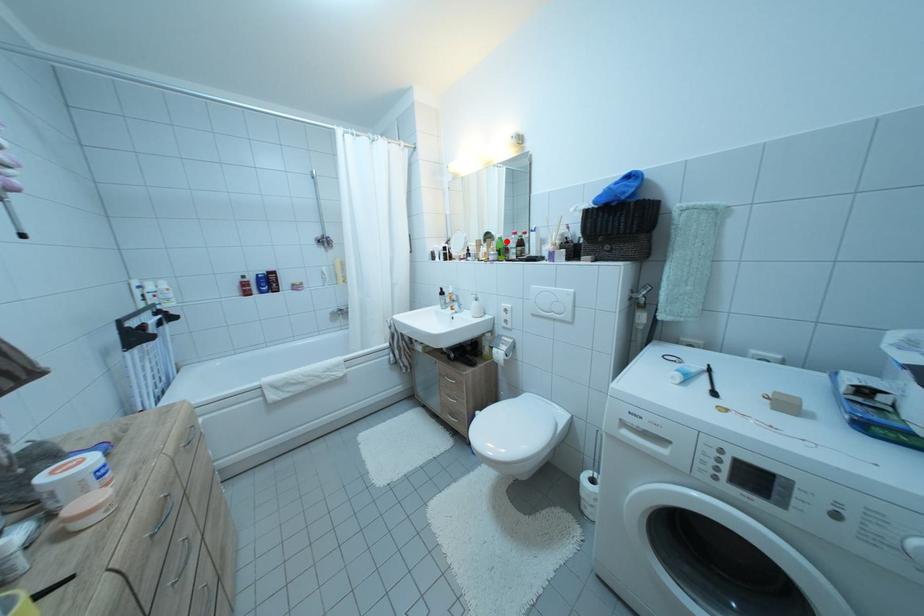
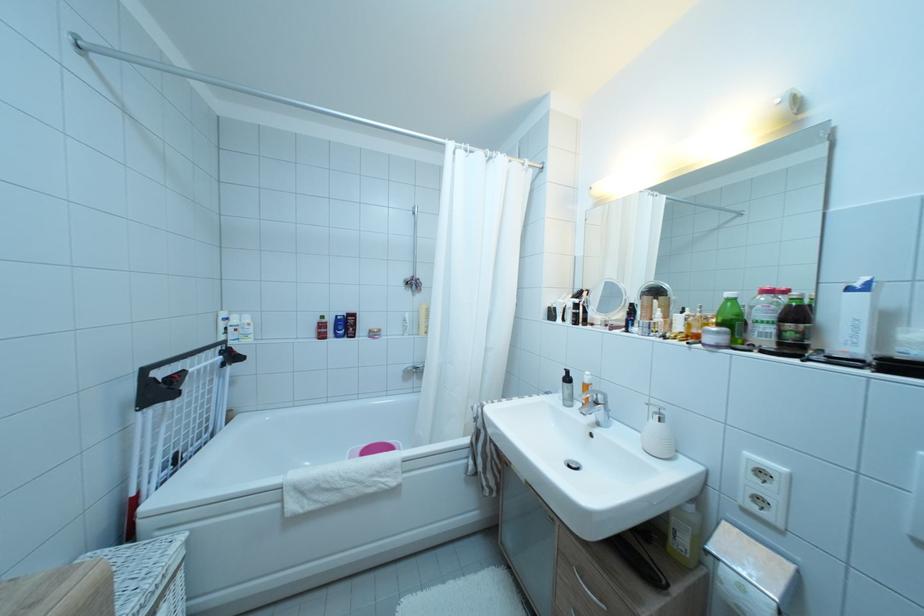
Locate, in the second image, the point that corresponds to the highlighted location in the first image.

(736, 300)